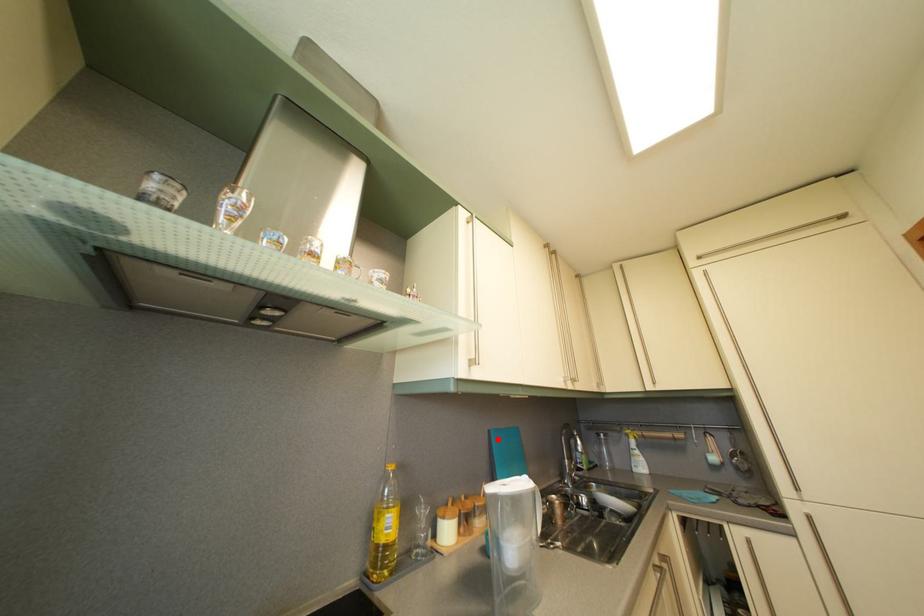
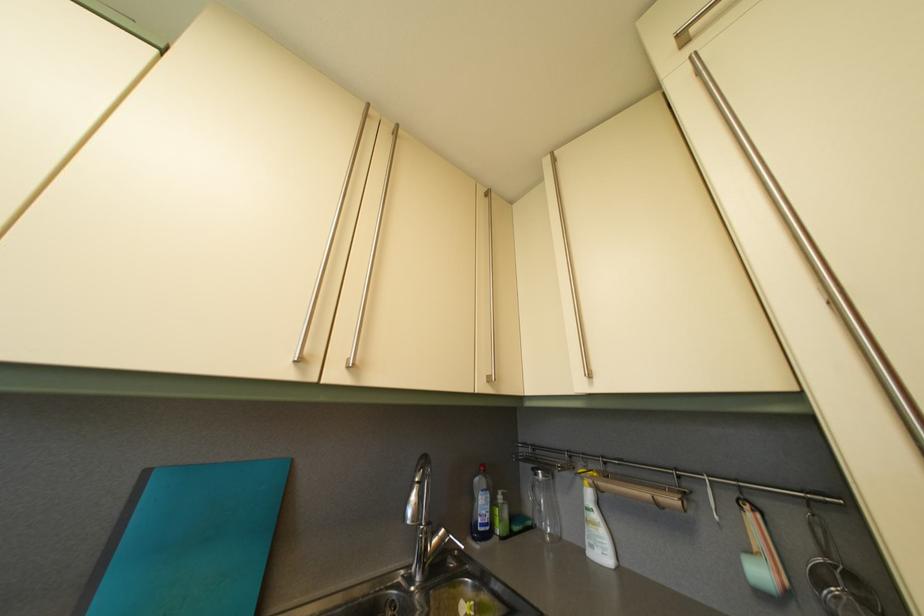
Locate, in the second image, the point that corresponds to the highlighted location in the first image.

(154, 480)